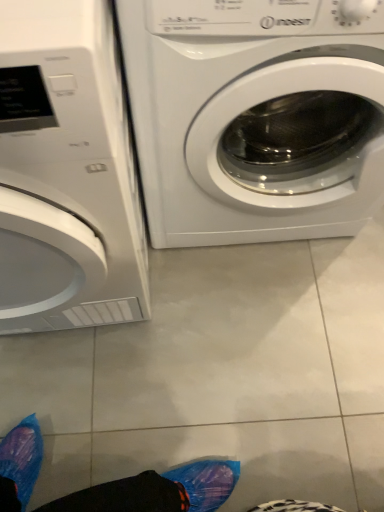
Image resolution: width=384 pixels, height=512 pixels. What are the coordinates of `white glossy washing machine at center, the 2th washing machine in the left-to-right sequence` in the screenshot? It's located at (256, 116).

Describe the element at coordinates (256, 116) in the screenshot. I see `white glossy washing machine at center, the 1th washing machine positioned from the right` at that location.

From the picture: What is the approximate width of white glossy washing machine at left, which ranks as the 2th washing machine in right-to-left order?

white glossy washing machine at left, which ranks as the 2th washing machine in right-to-left order, is 28.42 inches wide.

Where is `white glossy washing machine at left, which ranks as the 2th washing machine in right-to-left order`? white glossy washing machine at left, which ranks as the 2th washing machine in right-to-left order is located at coordinates (66, 173).

Describe the element at coordinates (66, 173) in the screenshot. Image resolution: width=384 pixels, height=512 pixels. I see `white glossy washing machine at left, which ranks as the 2th washing machine in right-to-left order` at that location.

You are a GUI agent. You are given a task and a screenshot of the screen. Output one action in this format:
    pyautogui.click(x=<x>, y=<y>)
    Task: Click on the white glossy washing machine at center, the 1th washing machine positioned from the right
    The width and height of the screenshot is (384, 512).
    Given the screenshot: What is the action you would take?
    pyautogui.click(x=256, y=116)

Is white glossy washing machine at center, the 2th washing machine in the left-to-right sequence, to the right of white glossy washing machine at left, which ranks as the 2th washing machine in right-to-left order, from the viewer's perspective?

Yes.

Which object is closer to the camera taking this photo, white glossy washing machine at center, the 1th washing machine positioned from the right, or white glossy washing machine at left, the first washing machine in the left-to-right sequence?

white glossy washing machine at left, the first washing machine in the left-to-right sequence.

Is point (138, 133) farther from viewer compared to point (42, 267)?

Yes.

From the image's perspective, between white glossy washing machine at center, the 2th washing machine in the left-to-right sequence, and white glossy washing machine at left, which ranks as the 2th washing machine in right-to-left order, which one is located above?

white glossy washing machine at center, the 2th washing machine in the left-to-right sequence, is shown above in the image.

From a real-world perspective, who is located higher, white glossy washing machine at center, the 1th washing machine positioned from the right, or white glossy washing machine at left, which ranks as the 2th washing machine in right-to-left order?

white glossy washing machine at left, which ranks as the 2th washing machine in right-to-left order.

Consider the image. Does white glossy washing machine at center, the 1th washing machine positioned from the right, have a lesser width compared to white glossy washing machine at left, which ranks as the 2th washing machine in right-to-left order?

Yes, white glossy washing machine at center, the 1th washing machine positioned from the right, is thinner than white glossy washing machine at left, which ranks as the 2th washing machine in right-to-left order.

Which of these two, white glossy washing machine at center, the 1th washing machine positioned from the right, or white glossy washing machine at left, the first washing machine in the left-to-right sequence, stands taller?

white glossy washing machine at left, the first washing machine in the left-to-right sequence, is taller.

Based on their sizes in the image, would you say white glossy washing machine at center, the 2th washing machine in the left-to-right sequence, is bigger or smaller than white glossy washing machine at left, the first washing machine in the left-to-right sequence?

white glossy washing machine at center, the 2th washing machine in the left-to-right sequence, is smaller than white glossy washing machine at left, the first washing machine in the left-to-right sequence.

Does white glossy washing machine at center, the 2th washing machine in the left-to-right sequence, contain white glossy washing machine at left, the first washing machine in the left-to-right sequence?

No, white glossy washing machine at center, the 2th washing machine in the left-to-right sequence, does not contain white glossy washing machine at left, the first washing machine in the left-to-right sequence.

Is white glossy washing machine at center, the 2th washing machine in the left-to-right sequence, placed right next to white glossy washing machine at left, which ranks as the 2th washing machine in right-to-left order?

No, white glossy washing machine at center, the 2th washing machine in the left-to-right sequence, is not with white glossy washing machine at left, which ranks as the 2th washing machine in right-to-left order.

Does white glossy washing machine at center, the 2th washing machine in the left-to-right sequence, turn towards white glossy washing machine at left, the first washing machine in the left-to-right sequence?

No, white glossy washing machine at center, the 2th washing machine in the left-to-right sequence, is not oriented towards white glossy washing machine at left, the first washing machine in the left-to-right sequence.

Can you tell me how much white glossy washing machine at center, the 1th washing machine positioned from the right, and white glossy washing machine at left, the first washing machine in the left-to-right sequence, differ in facing direction?

The angular difference between white glossy washing machine at center, the 1th washing machine positioned from the right, and white glossy washing machine at left, the first washing machine in the left-to-right sequence, is 0.383 degrees.

At what (x,y) coordinates should I click in order to perform the action: click on washing machine that is behind the white glossy washing machine at left, which ranks as the 2th washing machine in right-to-left order. Please return your answer as a coordinate pair (x, y). The height and width of the screenshot is (512, 384). Looking at the image, I should click on coord(256,116).

Consider the image. Which object is positioned more to the left, white glossy washing machine at left, which ranks as the 2th washing machine in right-to-left order, or white glossy washing machine at center, the 1th washing machine positioned from the right?

white glossy washing machine at left, which ranks as the 2th washing machine in right-to-left order, is more to the left.

Which is behind, white glossy washing machine at left, which ranks as the 2th washing machine in right-to-left order, or white glossy washing machine at center, the 2th washing machine in the left-to-right sequence?

white glossy washing machine at center, the 2th washing machine in the left-to-right sequence, is behind.

Is point (20, 145) positioned in front of point (352, 106)?

Yes, it is.

Based on the photo, from the image's perspective, which one is positioned higher, white glossy washing machine at left, the first washing machine in the left-to-right sequence, or white glossy washing machine at center, the 1th washing machine positioned from the right?

white glossy washing machine at center, the 1th washing machine positioned from the right.

From a real-world perspective, is white glossy washing machine at left, the first washing machine in the left-to-right sequence, positioned over white glossy washing machine at center, the 2th washing machine in the left-to-right sequence, based on gravity?

Indeed, from a real-world perspective, white glossy washing machine at left, the first washing machine in the left-to-right sequence, stands above white glossy washing machine at center, the 2th washing machine in the left-to-right sequence.

Considering the sizes of white glossy washing machine at left, the first washing machine in the left-to-right sequence, and white glossy washing machine at center, the 2th washing machine in the left-to-right sequence, in the image, is white glossy washing machine at left, the first washing machine in the left-to-right sequence, wider or thinner than white glossy washing machine at center, the 2th washing machine in the left-to-right sequence,?

white glossy washing machine at left, the first washing machine in the left-to-right sequence, is wider than white glossy washing machine at center, the 2th washing machine in the left-to-right sequence.

Who is shorter, white glossy washing machine at left, which ranks as the 2th washing machine in right-to-left order, or white glossy washing machine at center, the 1th washing machine positioned from the right?

white glossy washing machine at center, the 1th washing machine positioned from the right, is shorter.

Can you confirm if white glossy washing machine at left, which ranks as the 2th washing machine in right-to-left order, is bigger than white glossy washing machine at center, the 2th washing machine in the left-to-right sequence?

Yes, white glossy washing machine at left, which ranks as the 2th washing machine in right-to-left order, is bigger than white glossy washing machine at center, the 2th washing machine in the left-to-right sequence.

Is white glossy washing machine at center, the 1th washing machine positioned from the right, a part of white glossy washing machine at left, the first washing machine in the left-to-right sequence?

No, white glossy washing machine at left, the first washing machine in the left-to-right sequence, does not contain white glossy washing machine at center, the 1th washing machine positioned from the right.

Consider the image. Is white glossy washing machine at left, the first washing machine in the left-to-right sequence, not close to white glossy washing machine at center, the 2th washing machine in the left-to-right sequence?

They are positioned close to each other.

Could you tell me if white glossy washing machine at left, the first washing machine in the left-to-right sequence, is facing white glossy washing machine at center, the 2th washing machine in the left-to-right sequence?

No, white glossy washing machine at left, the first washing machine in the left-to-right sequence, is not oriented towards white glossy washing machine at center, the 2th washing machine in the left-to-right sequence.

How distant is white glossy washing machine at left, which ranks as the 2th washing machine in right-to-left order, from white glossy washing machine at center, the 1th washing machine positioned from the right?

white glossy washing machine at left, which ranks as the 2th washing machine in right-to-left order, and white glossy washing machine at center, the 1th washing machine positioned from the right, are 9.68 inches apart from each other.

The image size is (384, 512). In order to click on washing machine behind the white glossy washing machine at left, which ranks as the 2th washing machine in right-to-left order in this screenshot , I will do `click(256, 116)`.

At what (x,y) coordinates should I click in order to perform the action: click on washing machine located behind the white glossy washing machine at left, which ranks as the 2th washing machine in right-to-left order. Please return your answer as a coordinate pair (x, y). Image resolution: width=384 pixels, height=512 pixels. Looking at the image, I should click on (256, 116).

You are a GUI agent. You are given a task and a screenshot of the screen. Output one action in this format:
    pyautogui.click(x=<x>, y=<y>)
    Task: Click on the washing machine located above the white glossy washing machine at center, the 1th washing machine positioned from the right (from a real-world perspective)
    Image resolution: width=384 pixels, height=512 pixels.
    Given the screenshot: What is the action you would take?
    pyautogui.click(x=66, y=173)